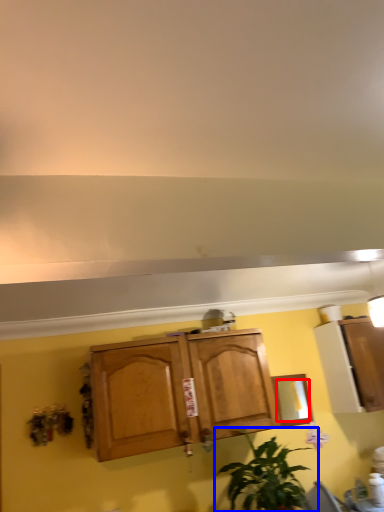
Question: Which object is further to the camera taking this photo, mirror (highlighted by a red box) or houseplant (highlighted by a blue box)?

Choices:
 (A) mirror
 (B) houseplant

Answer: (A)